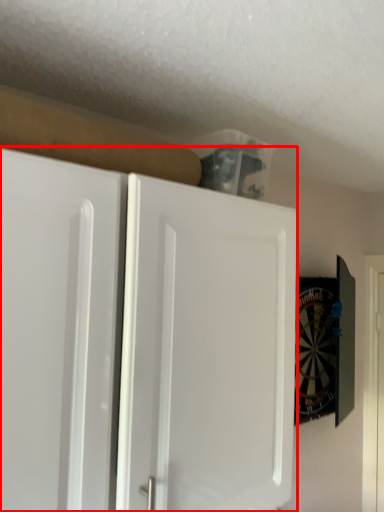
Question: From the image's perspective, what is the correct spatial positioning of cabinetry (annotated by the red box) in reference to door?

Choices:
 (A) below
 (B) above

Answer: (B)